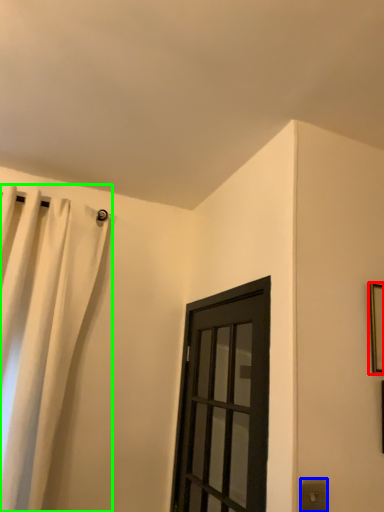
Question: Which object is positioned farthest from picture frame (highlighted by a red box)? Select from electric outlet (highlighted by a blue box) and curtain (highlighted by a green box).

Choices:
 (A) electric outlet
 (B) curtain

Answer: (B)